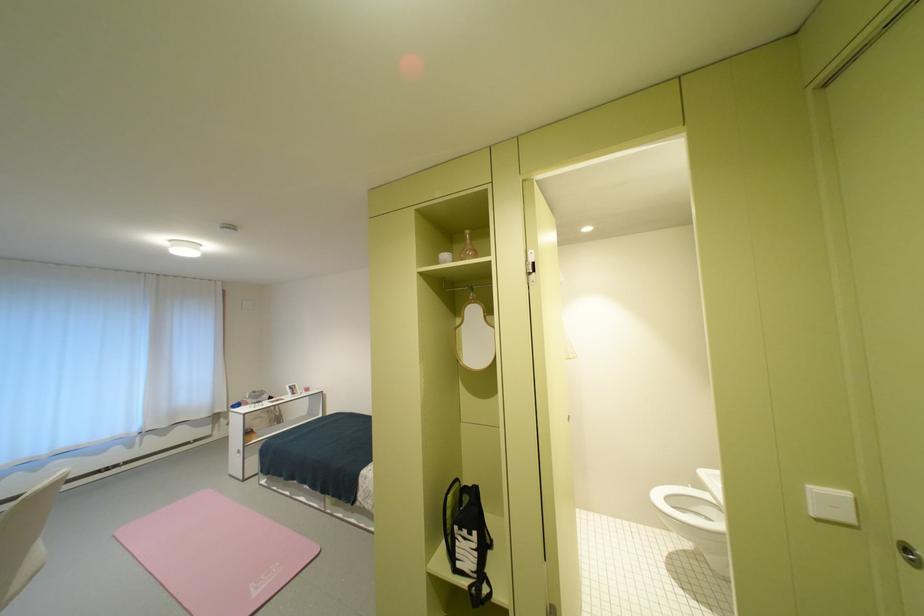
Locate an element on the screen. white chair sitting surface is located at coordinates (20, 546).